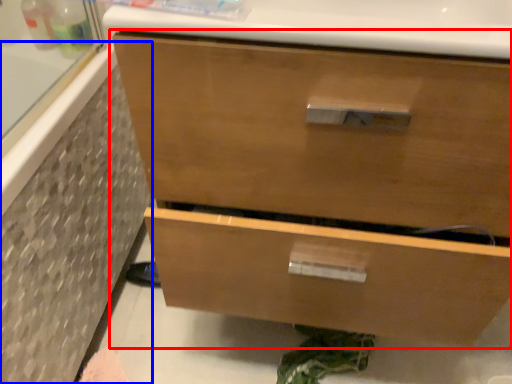
Question: Which object is closer to the camera taking this photo, chest of drawers (highlighted by a red box) or bath (highlighted by a blue box)?

Choices:
 (A) chest of drawers
 (B) bath

Answer: (A)